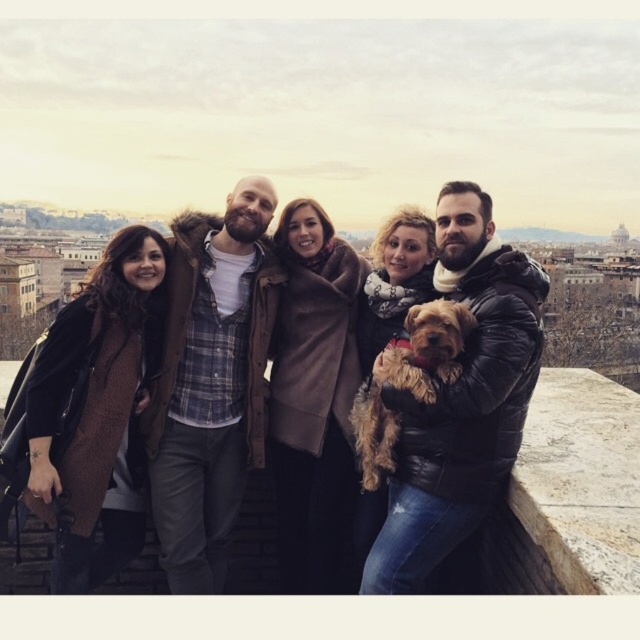
Can you confirm if black leather jacket at center is taller than brown woolen scarf at upper center?

Yes.

Between black leather jacket at center and brown woolen scarf at upper center, which one appears on the left side from the viewer's perspective?

Positioned to the left is brown woolen scarf at upper center.

What do you see at coordinates (461, 404) in the screenshot? Image resolution: width=640 pixels, height=640 pixels. I see `black leather jacket at center` at bounding box center [461, 404].

Where is `black leather jacket at center`? black leather jacket at center is located at coordinates (461, 404).

Who is taller, brown woolen scarf at upper center or fuzzy brown dog at center?

brown woolen scarf at upper center is taller.

Who is positioned more to the left, brown woolen scarf at upper center or fuzzy brown dog at center?

From the viewer's perspective, brown woolen scarf at upper center appears more on the left side.

Between point (509, 256) and point (429, 348), which one is positioned in front?

Positioned in front is point (429, 348).

Locate an element on the screen. The image size is (640, 640). brown woolen scarf at upper center is located at coordinates tap(477, 369).

Between black leather jacket at center and fuzzy brown dog at center, which one is positioned lower?

Positioned lower is black leather jacket at center.

Who is higher up, black leather jacket at center or fuzzy brown dog at center?

fuzzy brown dog at center is higher up.

Which is behind, point (458, 294) or point (422, 360)?

The point (458, 294) is more distant.

At what (x,y) coordinates should I click in order to perform the action: click on black leather jacket at center. Please return your answer as a coordinate pair (x, y). The height and width of the screenshot is (640, 640). Looking at the image, I should click on [461, 404].